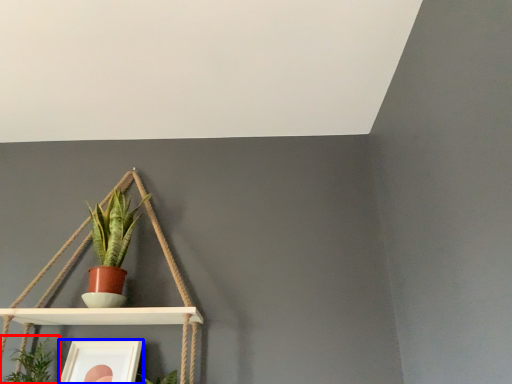
Question: Which point is further to the camera, houseplant (highlighted by a red box) or picture frame (highlighted by a blue box)?

Choices:
 (A) houseplant
 (B) picture frame

Answer: (B)